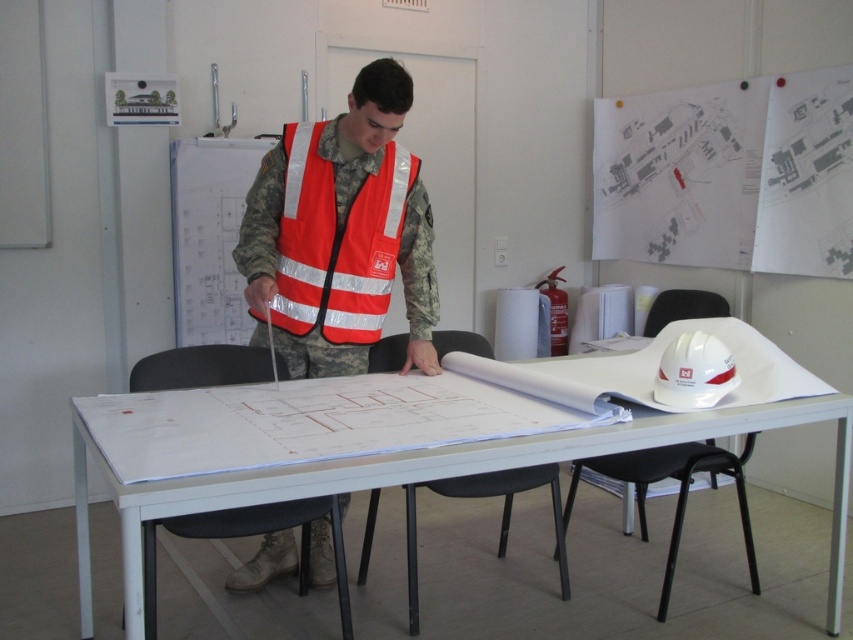
Question: Does orange reflective vest at center appear on the right side of white matte hard hat at upper right?

Choices:
 (A) yes
 (B) no

Answer: (B)

Question: Is orange reflective vest at center to the left of reflective orange safety vest at center from the viewer's perspective?

Choices:
 (A) no
 (B) yes

Answer: (B)

Question: Which point appears farthest from the camera in this image?

Choices:
 (A) (573, 448)
 (B) (706, 365)

Answer: (B)

Question: Can you confirm if white plastic table at center is positioned above white matte hard hat at upper right?

Choices:
 (A) no
 (B) yes

Answer: (A)

Question: Which object is closer to the camera taking this photo?

Choices:
 (A) orange reflective vest at center
 (B) white matte hard hat at upper right
 (C) white plastic table at center

Answer: (C)

Question: Which of the following is the farthest from the observer?

Choices:
 (A) white matte hard hat at upper right
 (B) reflective orange safety vest at center
 (C) orange reflective vest at center

Answer: (B)